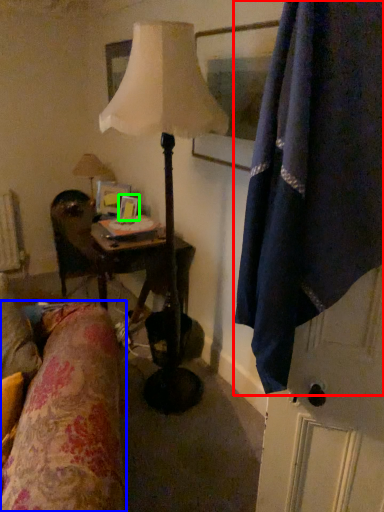
Question: Which is farther away from curtain (highlighted by a red box)? bedding (highlighted by a blue box) or picture frame (highlighted by a green box)?

Choices:
 (A) bedding
 (B) picture frame

Answer: (B)